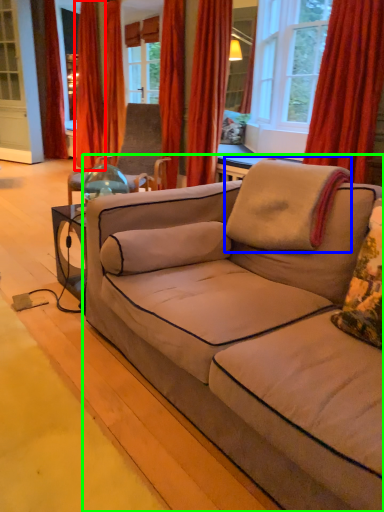
Question: Which object is positioned farthest from curtain (highlighted by a red box)? Select from pillow (highlighted by a blue box) and studio couch (highlighted by a green box).

Choices:
 (A) pillow
 (B) studio couch

Answer: (B)